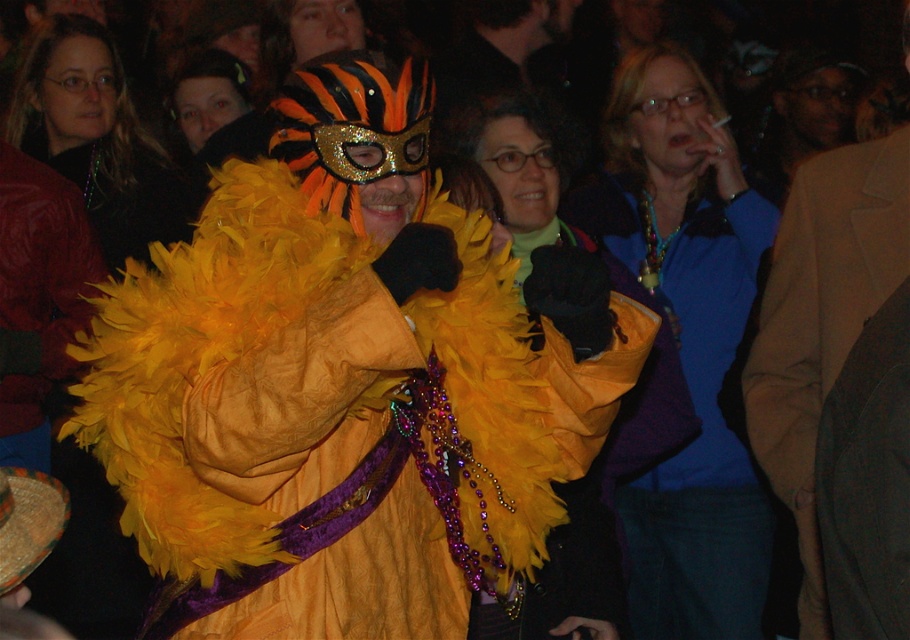
Question: Can you confirm if feathered yellow coat at center is positioned to the right of velvet brown coat at center?

Choices:
 (A) no
 (B) yes

Answer: (A)

Question: Among these objects, which one is nearest to the camera?

Choices:
 (A) feathered yellow coat at center
 (B) velvet brown coat at center

Answer: (B)

Question: Is feathered yellow coat at center to the right of velvet brown coat at center from the viewer's perspective?

Choices:
 (A) no
 (B) yes

Answer: (A)

Question: Can you confirm if feathered yellow coat at center is bigger than velvet brown coat at center?

Choices:
 (A) no
 (B) yes

Answer: (B)

Question: Which point is closer to the camera?

Choices:
 (A) feathered yellow coat at center
 (B) velvet brown coat at center

Answer: (B)